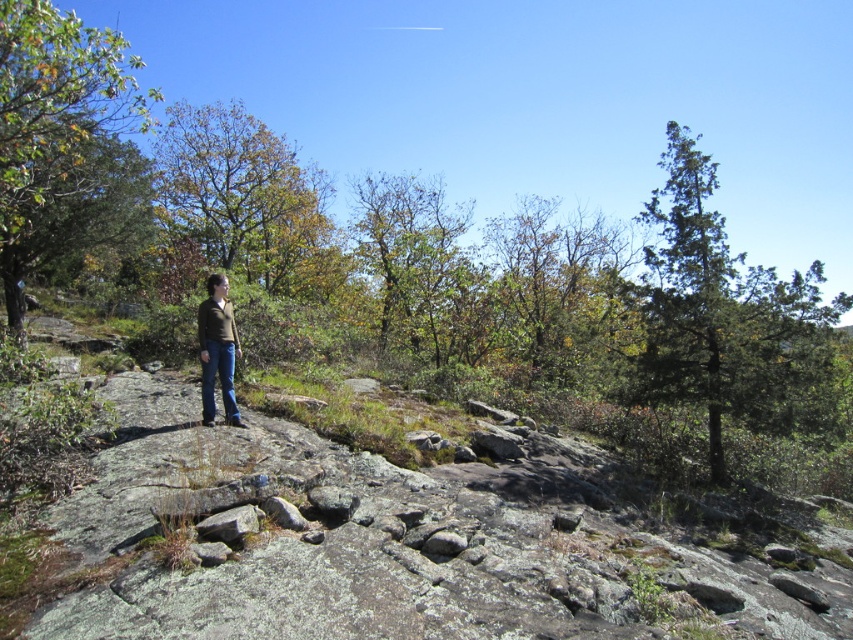
Looking at this image, does green coniferous tree at upper right have a lesser width compared to brown matte jacket at center?

Incorrect, green coniferous tree at upper right's width is not less than brown matte jacket at center's.

How far apart are green coniferous tree at upper right and brown matte jacket at center?

They are 35.66 feet apart.

Is point (763, 301) positioned behind point (215, 349)?

Yes, it is behind point (215, 349).

You are a GUI agent. You are given a task and a screenshot of the screen. Output one action in this format:
    pyautogui.click(x=<x>, y=<y>)
    Task: Click on the green coniferous tree at upper right
    The image size is (853, 640).
    Given the screenshot: What is the action you would take?
    pyautogui.click(x=727, y=316)

Who is lower down, green coniferous tree at upper right or yellow-green foliage at upper left?

green coniferous tree at upper right is lower down.

Measure the distance between point [795,273] and camera.

Point [795,273] and camera are 65.75 meters apart.

You are a GUI agent. You are given a task and a screenshot of the screen. Output one action in this format:
    pyautogui.click(x=<x>, y=<y>)
    Task: Click on the green coniferous tree at upper right
    This screenshot has height=640, width=853.
    Given the screenshot: What is the action you would take?
    pyautogui.click(x=727, y=316)

In the scene shown: Who is more distant from viewer, [105,225] or [221,285]?

Positioned behind is point [105,225].

Is brown leafy tree at upper left thinner than brown matte jacket at center?

In fact, brown leafy tree at upper left might be wider than brown matte jacket at center.

Who is more forward, (9, 140) or (221, 323)?

Point (9, 140)

I want to click on brown leafy tree at upper left, so click(x=61, y=138).